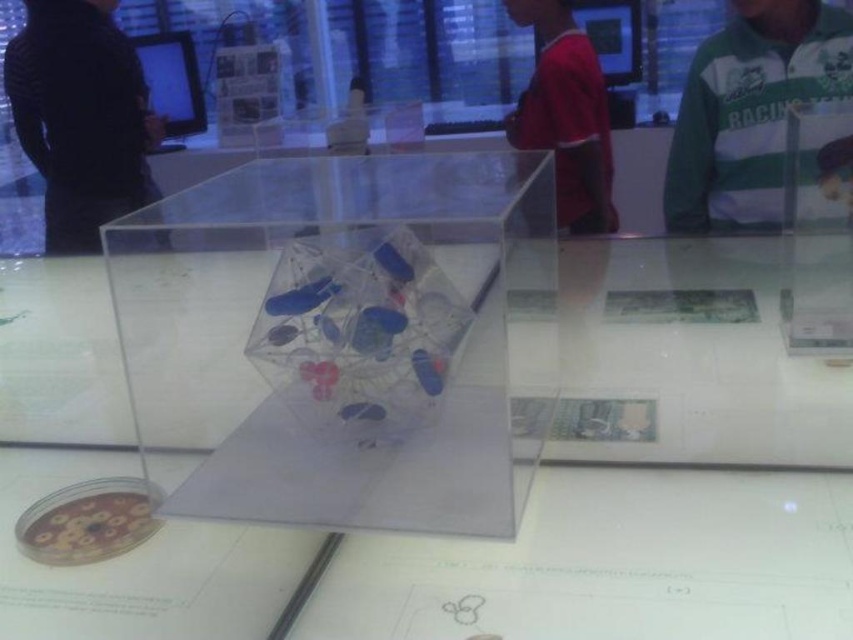
You are standing in front of an interactive exhibit with a cube container on a glass table. You see a green and white jersey at upper right. Where exactly is the green and white jersey located in relation to the cube container?

The green and white jersey at upper right is located at point coordinates of 0.173 on the x axis and 0.880 on the y axis relative to the cube container.